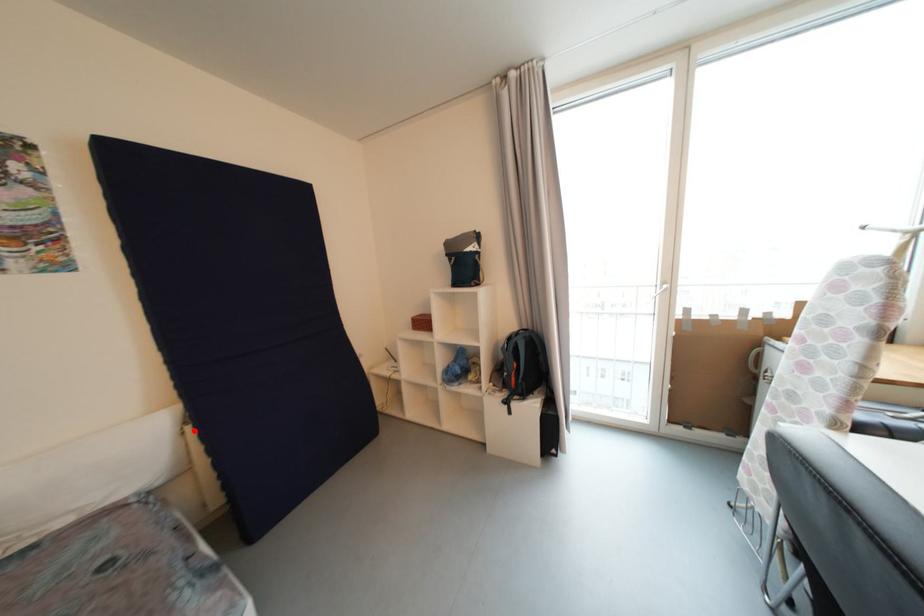
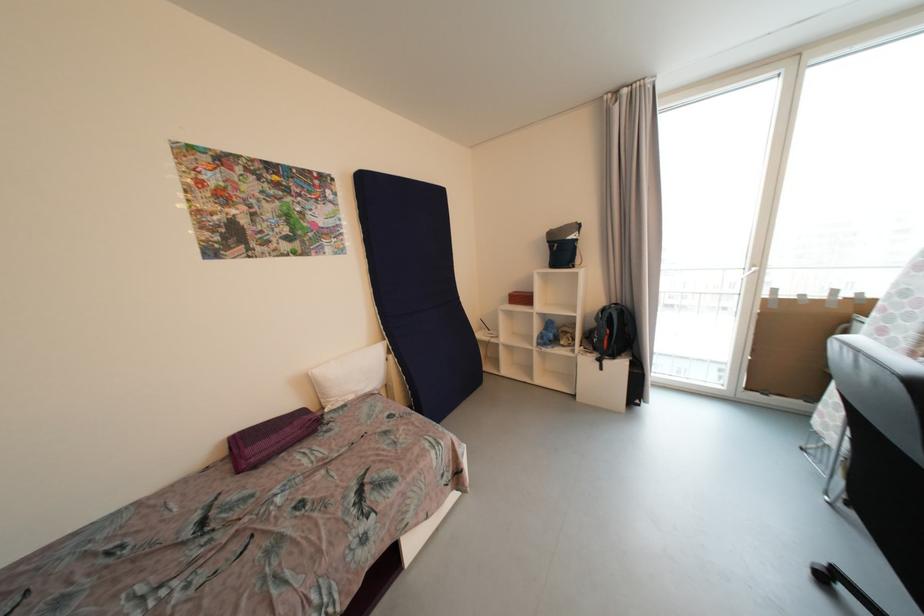
Find the pixel in the second image that matches the highlighted location in the first image.

(396, 359)